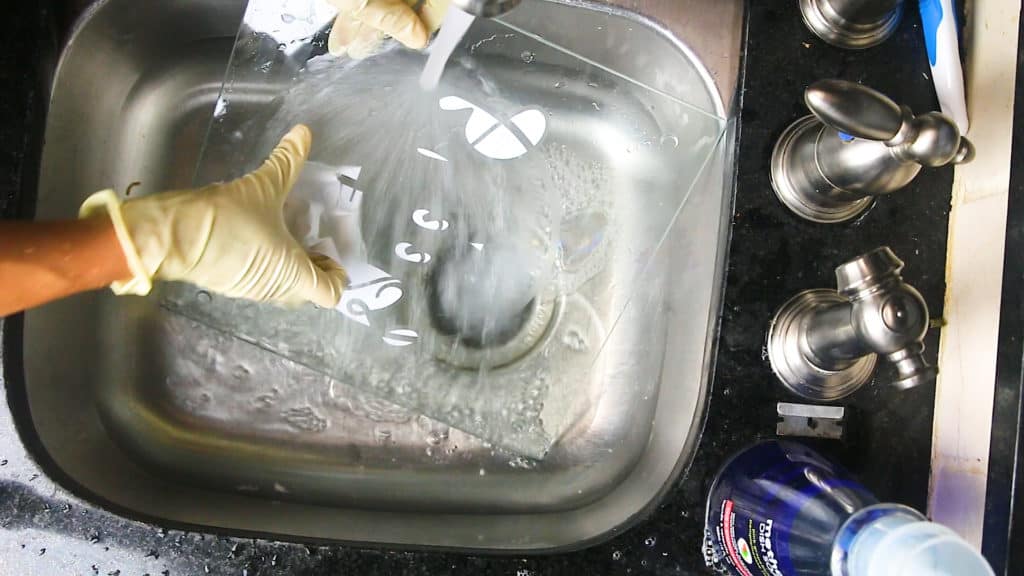
This screenshot has height=576, width=1024. Find the location of `dish soap bottle`. dish soap bottle is located at coordinates (854, 526).